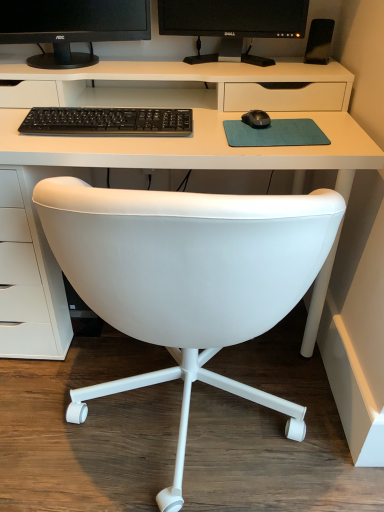
Question: From a real-world perspective, is black matte speaker at upper right located beneath white plastic desk at center?

Choices:
 (A) yes
 (B) no

Answer: (B)

Question: Is the position of black matte speaker at upper right less distant than that of white plastic desk at center?

Choices:
 (A) yes
 (B) no

Answer: (B)

Question: Is black matte speaker at upper right wider than white plastic desk at center?

Choices:
 (A) yes
 (B) no

Answer: (B)

Question: Are black matte speaker at upper right and white plastic desk at center located far from each other?

Choices:
 (A) no
 (B) yes

Answer: (A)

Question: Is black matte speaker at upper right next to white plastic desk at center?

Choices:
 (A) no
 (B) yes

Answer: (A)

Question: From the image's perspective, is white plastic desk at center located above or below white leather chair at center?

Choices:
 (A) above
 (B) below

Answer: (A)

Question: Visually, is white plastic desk at center positioned to the left or to the right of white leather chair at center?

Choices:
 (A) right
 (B) left

Answer: (B)

Question: Is white plastic desk at center situated inside white leather chair at center or outside?

Choices:
 (A) inside
 (B) outside

Answer: (B)

Question: Is point (349, 140) positioned closer to the camera than point (289, 215)?

Choices:
 (A) farther
 (B) closer

Answer: (A)

Question: Considering the positions of white plastic desk at center and black matte monitor at upper center, arranged as the second computer monitor when viewed from the right, in the image, is white plastic desk at center taller or shorter than black matte monitor at upper center, arranged as the second computer monitor when viewed from the right,?

Choices:
 (A) short
 (B) tall

Answer: (B)

Question: Relative to black matte monitor at upper center, arranged as the second computer monitor when viewed from the right, is white plastic desk at center in front or behind?

Choices:
 (A) behind
 (B) front

Answer: (B)

Question: Is point (21, 86) closer or farther from the camera than point (71, 15)?

Choices:
 (A) closer
 (B) farther

Answer: (A)

Question: From the image's perspective, relative to black matte monitor at upper center, arranged as the second computer monitor when viewed from the right, is white plastic desk at center above or below?

Choices:
 (A) above
 (B) below

Answer: (B)

Question: Is black matte monitor at upper center, arranged as the second computer monitor when viewed from the right, wider or thinner than black matte keyboard at center?

Choices:
 (A) thin
 (B) wide

Answer: (B)

Question: Do you think black matte monitor at upper center, arranged as the second computer monitor when viewed from the right, is within black matte keyboard at center, or outside of it?

Choices:
 (A) inside
 (B) outside

Answer: (B)